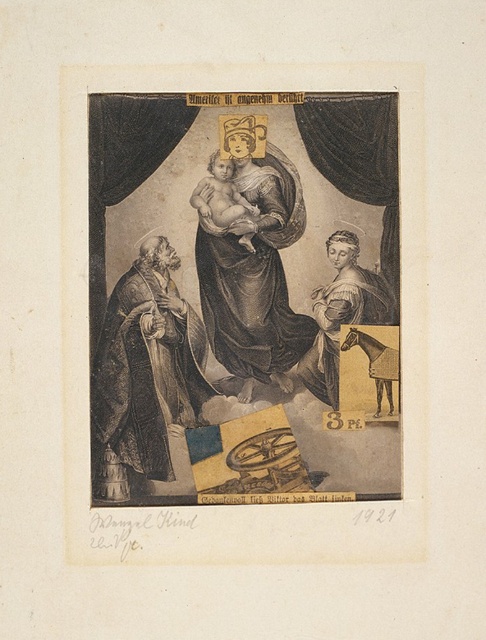
This screenshot has width=486, height=640. Identify the location of matte gold halo at center. tap(252, 262).

Is point (278, 340) behind point (90, 180)?

Yes, it is behind point (90, 180).

You are a GUI agent. You are given a task and a screenshot of the screen. Output one action in this format:
    pyautogui.click(x=<x>, y=<y>)
    Task: Click on the matte gold halo at center
    The width and height of the screenshot is (486, 640).
    Given the screenshot: What is the action you would take?
    click(x=252, y=262)

Is black velvet curtain at left further to the viewer compared to smooth gold statue at right?

Yes, black velvet curtain at left is further from the viewer.

Is black velvet curtain at left positioned in front of smooth gold statue at right?

No, it is behind smooth gold statue at right.

Who is more forward, (104, 205) or (329, 241)?

Result: Point (104, 205) is in front.

The height and width of the screenshot is (640, 486). Find the location of `black velvet curtain at left`. black velvet curtain at left is located at coordinates (123, 170).

Looking at this image, does black velvet curtain at left appear under black velvet curtain at upper center?

Correct, black velvet curtain at left is located below black velvet curtain at upper center.

Find the location of `black velvet curtain at left`. black velvet curtain at left is located at coordinates (123, 170).

Locate an element on the screen. The height and width of the screenshot is (640, 486). black velvet curtain at left is located at coordinates (123, 170).